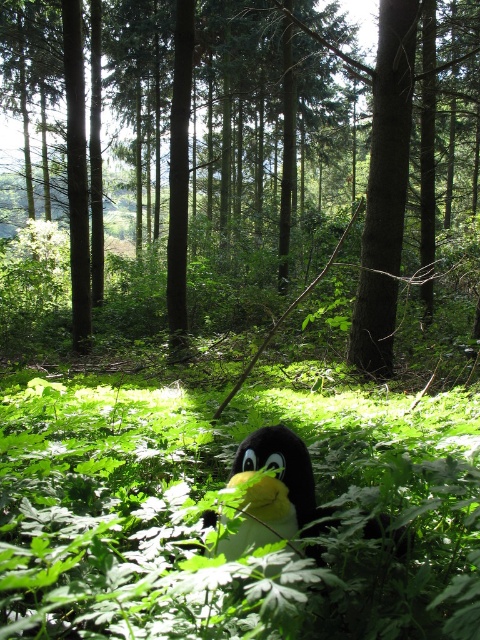
Question: Which point is closer to the camera?

Choices:
 (A) (285, 428)
 (B) (339, 106)

Answer: (A)

Question: Where is brown textured tree at center located in relation to soft plush penguin at center in the image?

Choices:
 (A) right
 (B) left

Answer: (B)

Question: Does brown textured tree at center appear on the right side of soft plush penguin at center?

Choices:
 (A) no
 (B) yes

Answer: (A)

Question: Does brown textured tree at center lie in front of soft plush penguin at center?

Choices:
 (A) yes
 (B) no

Answer: (B)

Question: Which of the following is the closest to the observer?

Choices:
 (A) soft plush penguin at center
 (B) brown textured tree at center

Answer: (A)